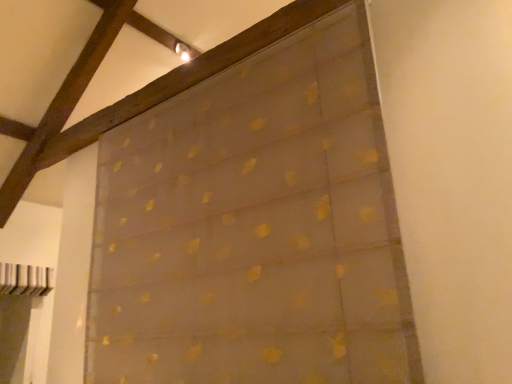
Question: Which direction should I rotate to look at translucent gold-patterned curtain at upper center?

Choices:
 (A) left
 (B) right

Answer: (A)

Question: Should I look upward or downward to see translucent gold-patterned curtain at upper center?

Choices:
 (A) up
 (B) down

Answer: (B)